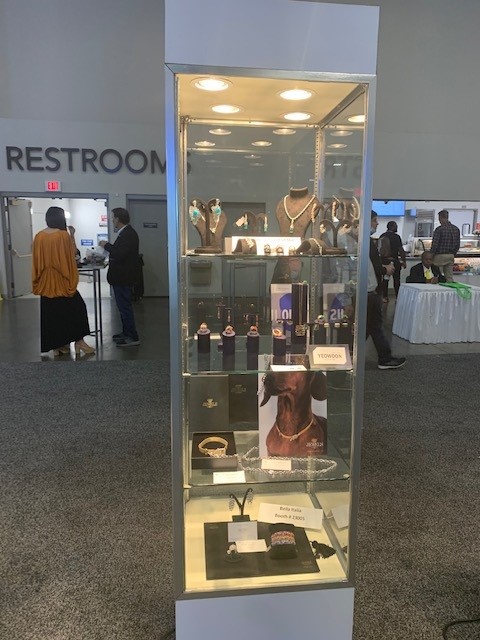
Locate an element on the screen. The width and height of the screenshot is (480, 640). window area is located at coordinates (413, 224).